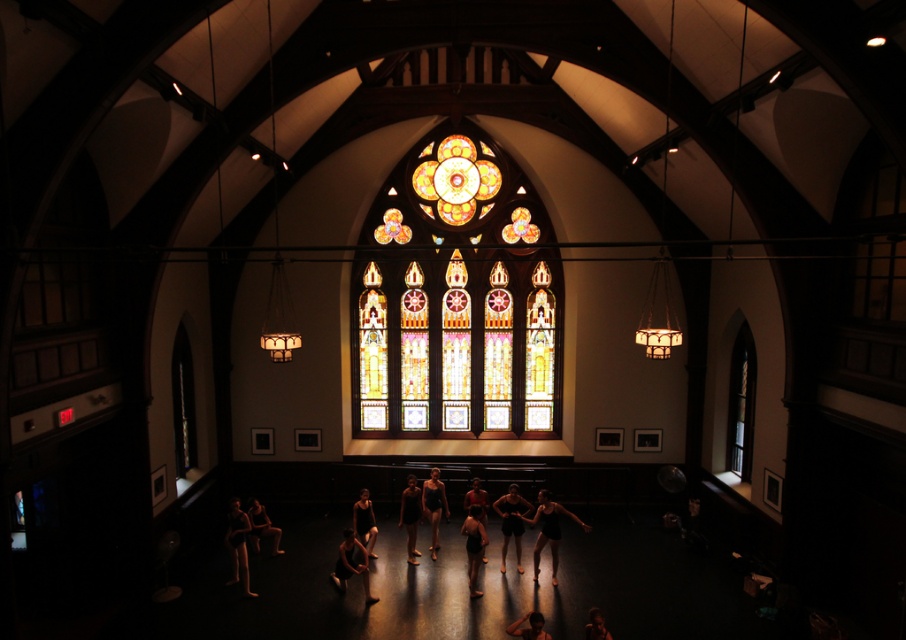
Question: Is stained glass at center closer to camera compared to black matte leotard at center?

Choices:
 (A) no
 (B) yes

Answer: (B)

Question: Does stained glass at center appear on the right side of black matte leotard at center?

Choices:
 (A) no
 (B) yes

Answer: (A)

Question: Which point is farther to the camera?

Choices:
 (A) (558, 536)
 (B) (545, 344)

Answer: (B)

Question: Does stained glass at center appear over black matte leotard at center?

Choices:
 (A) yes
 (B) no

Answer: (A)